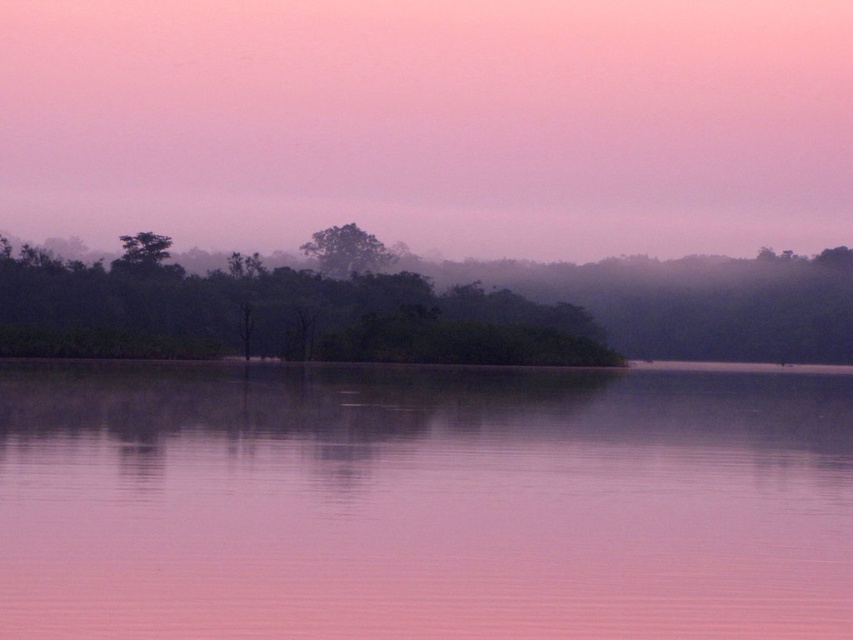
Does point (677, 548) come behind point (505, 10)?

No, (677, 548) is closer to viewer.

Who is more distant from viewer, (x=218, y=579) or (x=540, y=74)?

Positioned behind is point (x=540, y=74).

Locate an element on the screen. Image resolution: width=853 pixels, height=640 pixels. pink smooth water at center is located at coordinates (422, 502).

Is pink smooth water at center to the left of green matte tree at center from the viewer's perspective?

Incorrect, pink smooth water at center is not on the left side of green matte tree at center.

This screenshot has width=853, height=640. Describe the element at coordinates (422, 502) in the screenshot. I see `pink smooth water at center` at that location.

The height and width of the screenshot is (640, 853). Find the location of `pink smooth water at center`. pink smooth water at center is located at coordinates point(422,502).

Between green matte island at center and green matte tree at center, which one appears on the left side from the viewer's perspective?

From the viewer's perspective, green matte tree at center appears more on the left side.

The height and width of the screenshot is (640, 853). What are the coordinates of `green matte island at center` in the screenshot? It's located at (421, 310).

The width and height of the screenshot is (853, 640). I want to click on green matte island at center, so click(x=421, y=310).